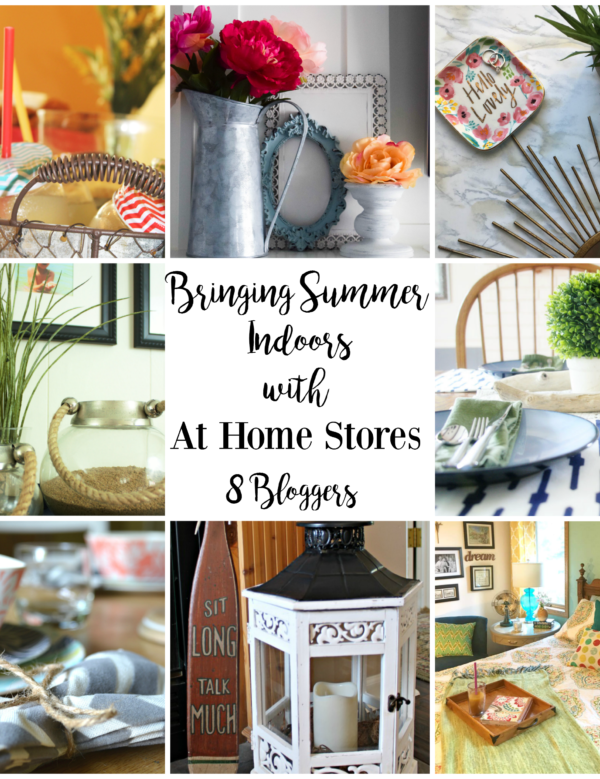
Where is `pictures`? pictures is located at coordinates (50, 283), (152, 301), (442, 562), (478, 541).